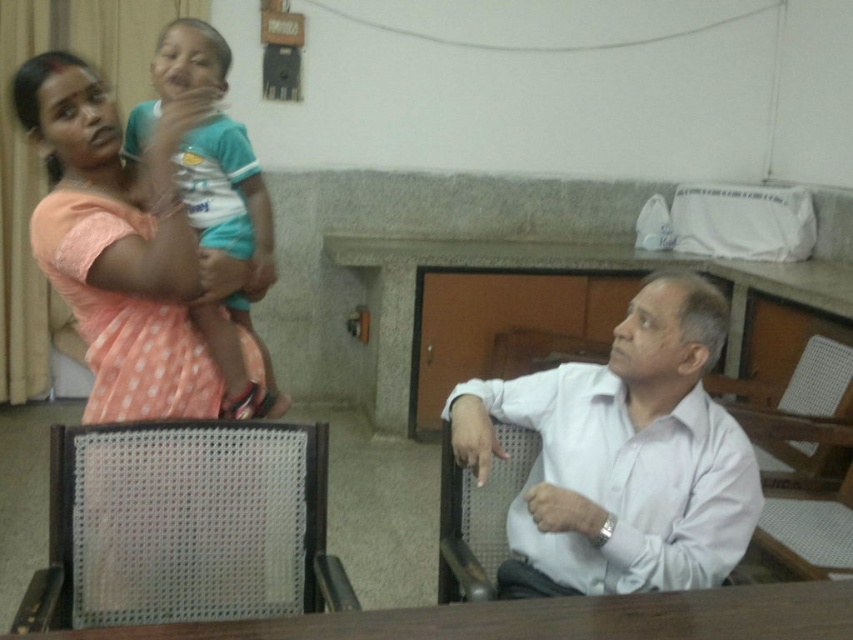
From the picture: You are a photographer who needs to capture a photo where both the white shirt at center and the teal jersey at upper left are clearly visible. Based on their positions, which one should you focus on first to ensure both are in frame?

Since the white shirt at center is below the teal jersey at upper left, you should focus on the teal jersey at upper left first to ensure both are within the camera frame.

You are a person who needs to place a heavy box on the brown wooden table at lower center. Considering the height of the metal mesh chair at right, will you be able to easily reach the table to place the box?

The brown wooden table at lower center has a lesser height compared to the metal mesh chair at right, so the table is shorter. This means you can easily reach it to place the box since it is lower than the chair.

You are a photographer standing at the camera position. You want to take a photo of the pink polka dot dress at upper left. However, you can only move forward or backward. Can you move closer to the dress to make it appear larger in the photo without moving the dress itself?

The pink polka dot dress at upper left is 4.93 feet away from camera. Since you can only move forward or backward, you can move closer to reduce the distance, making the dress appear larger in the photo.